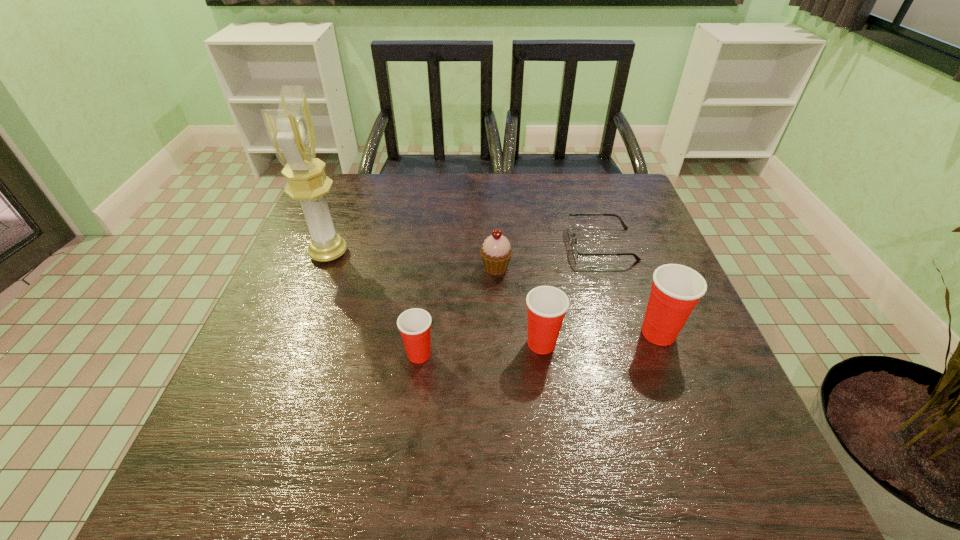
Image resolution: width=960 pixels, height=540 pixels. Identify the location of vacant position located on the right of the leftmost Dixie cup. (460, 354).

Locate an element on the screen. The image size is (960, 540). free space located on the back of the second Dixie cup from left to right is located at coordinates (530, 252).

You are a GUI agent. You are given a task and a screenshot of the screen. Output one action in this format:
    pyautogui.click(x=<x>, y=<y>)
    Task: Click on the free space located on the back of the rightmost Dixie cup
    The height and width of the screenshot is (540, 960).
    Given the screenshot: What is the action you would take?
    click(617, 225)

This screenshot has width=960, height=540. I want to click on vacant space located 0.110m on the front-facing side of the tallest object, so click(x=392, y=253).

I want to click on free space located 0.340m on the back of the fourth object from right to left, so click(492, 185).

At what (x,y) coordinates should I click in order to perform the action: click on blank space located 0.360m on the front-facing side of the spectacles. Please return your answer as a coordinate pair (x, y). Looking at the image, I should click on (428, 245).

You are a GUI agent. You are given a task and a screenshot of the screen. Output one action in this format:
    pyautogui.click(x=<x>, y=<y>)
    Task: Click on the vacant region located 0.270m on the front-facing side of the spectacles
    The height and width of the screenshot is (540, 960).
    Given the screenshot: What is the action you would take?
    pyautogui.click(x=464, y=245)

Locate an element on the screen. This screenshot has height=540, width=960. blank space located 0.260m on the front-facing side of the spectacles is located at coordinates (468, 245).

This screenshot has height=540, width=960. In order to click on object that is at the left edge in this screenshot , I will do `click(291, 130)`.

This screenshot has width=960, height=540. What are the coordinates of `Dixie cup located at the right edge` in the screenshot? It's located at (676, 289).